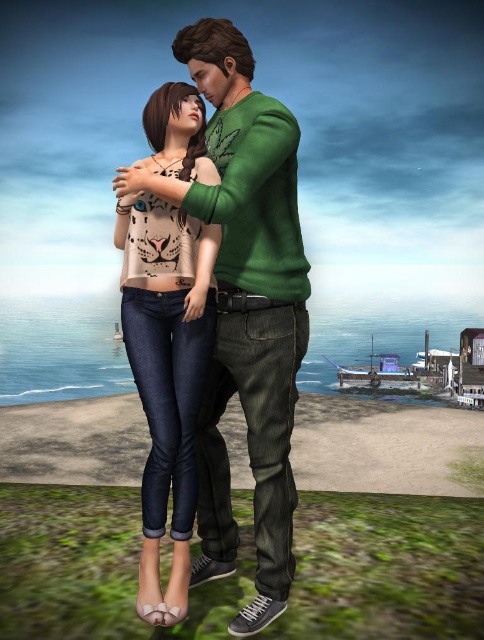
Question: Which point is closer to the camera?

Choices:
 (A) (287, 138)
 (B) (159, 410)

Answer: (A)

Question: Where is matte green sweater at center located in relation to matte beige top at center in the image?

Choices:
 (A) above
 (B) below

Answer: (B)

Question: Among these points, which one is nearest to the camera?

Choices:
 (A) (271, 573)
 (B) (163, 212)

Answer: (A)

Question: Does matte green sweater at center appear on the left side of matte beige top at center?

Choices:
 (A) no
 (B) yes

Answer: (A)

Question: Does matte green sweater at center appear under matte beige top at center?

Choices:
 (A) no
 (B) yes

Answer: (B)

Question: Which point is farther to the camera?

Choices:
 (A) (213, 301)
 (B) (263, 440)

Answer: (A)